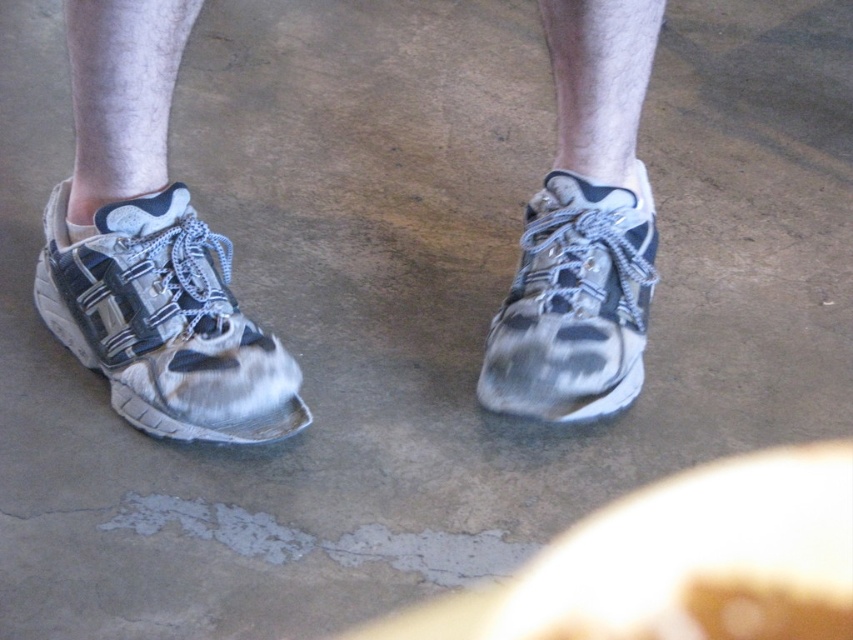
Who is lower down, worn leather sneakers at center or worn leather sneaker at center?

worn leather sneaker at center is lower down.

Is worn leather sneakers at center behind worn leather sneaker at center?

That is False.

This screenshot has width=853, height=640. Find the location of `worn leather sneakers at center`. worn leather sneakers at center is located at coordinates (149, 250).

You are a GUI agent. You are given a task and a screenshot of the screen. Output one action in this format:
    pyautogui.click(x=<x>, y=<y>)
    Task: Click on the worn leather sneakers at center
    The height and width of the screenshot is (640, 853).
    Given the screenshot: What is the action you would take?
    (149, 250)

Does worn leather sneakers at center lie behind worn leather sneaker at left?

No, worn leather sneakers at center is in front of worn leather sneaker at left.

Between point (122, 282) and point (94, 339), which one is positioned behind?

The point (94, 339) is more distant.

Is point (589, 116) positioned behind point (148, 380)?

That is True.

Where is `worn leather sneakers at center`? The width and height of the screenshot is (853, 640). worn leather sneakers at center is located at coordinates (149, 250).

Can you confirm if worn leather sneaker at left is smaller than worn leather sneaker at center?

No, worn leather sneaker at left is not smaller than worn leather sneaker at center.

Who is positioned more to the left, worn leather sneaker at left or worn leather sneaker at center?

worn leather sneaker at left is more to the left.

Between point (160, 349) and point (578, 358), which one is positioned behind?

The point (578, 358) is more distant.

The image size is (853, 640). I want to click on worn leather sneaker at left, so click(164, 321).